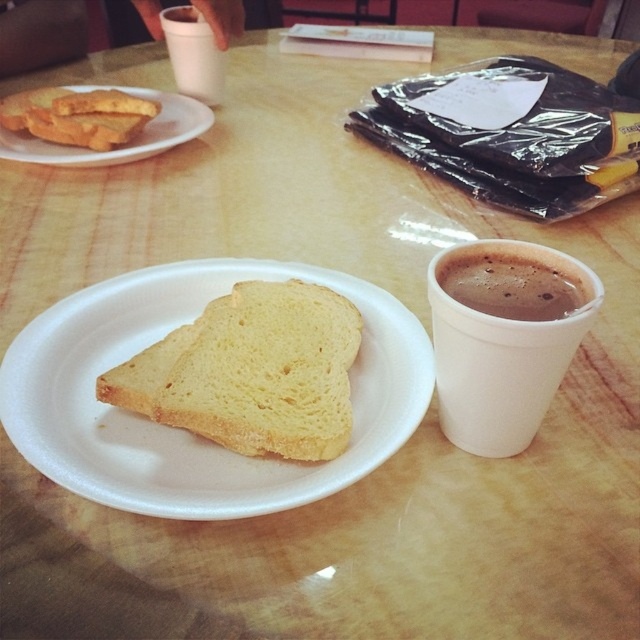
Question: Based on their relative distances, which object is nearer to the white styrofoam cup at right?

Choices:
 (A) white paper plate at upper left
 (B) white paper plate at center
 (C) white styrofoam cup at upper center

Answer: (B)

Question: Does white styrofoam cup at right appear on the right side of white styrofoam cup at upper center?

Choices:
 (A) yes
 (B) no

Answer: (A)

Question: Can you confirm if white soft bread at center is bigger than white styrofoam cup at right?

Choices:
 (A) yes
 (B) no

Answer: (A)

Question: Which object is farther from the camera taking this photo?

Choices:
 (A) white soft bread at center
 (B) brown matte cup of coffee at right

Answer: (A)

Question: Is brown matte cup of coffee at right bigger than white styrofoam cup at upper center?

Choices:
 (A) no
 (B) yes

Answer: (A)

Question: Based on their relative distances, which object is nearer to the white paper plate at center?

Choices:
 (A) white styrofoam cup at right
 (B) white styrofoam cup at upper center

Answer: (A)